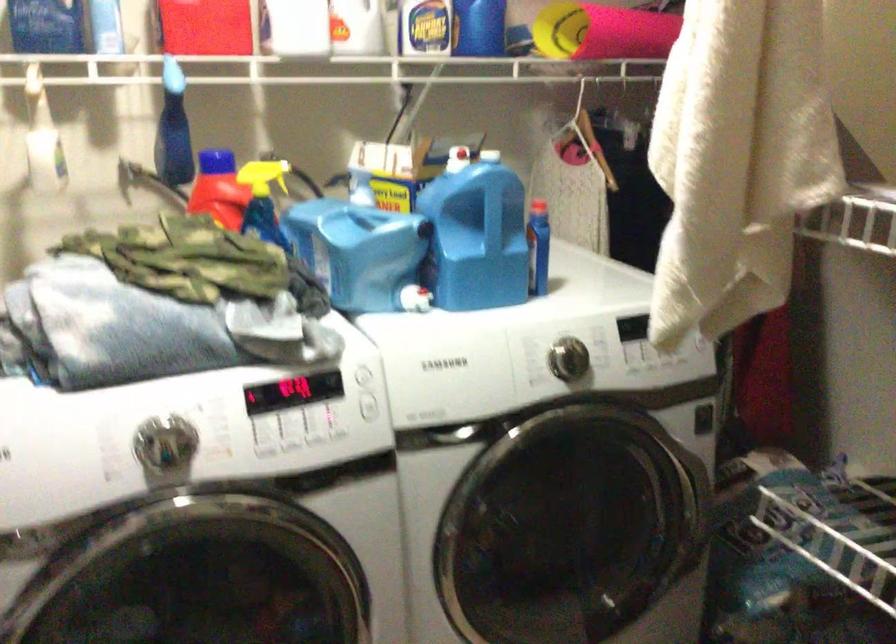
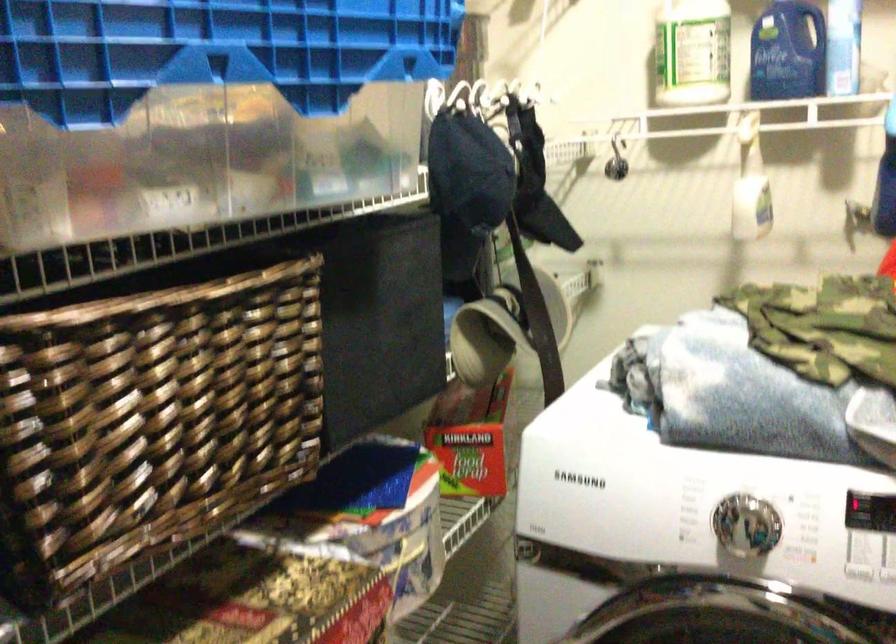
Question: The camera is either moving clockwise (left) or counter-clockwise (right) around the object. The first image is from the beginning of the video and the second image is from the end. Is the camera moving left or right when shooting the video?

Choices:
 (A) Left
 (B) Right

Answer: (B)